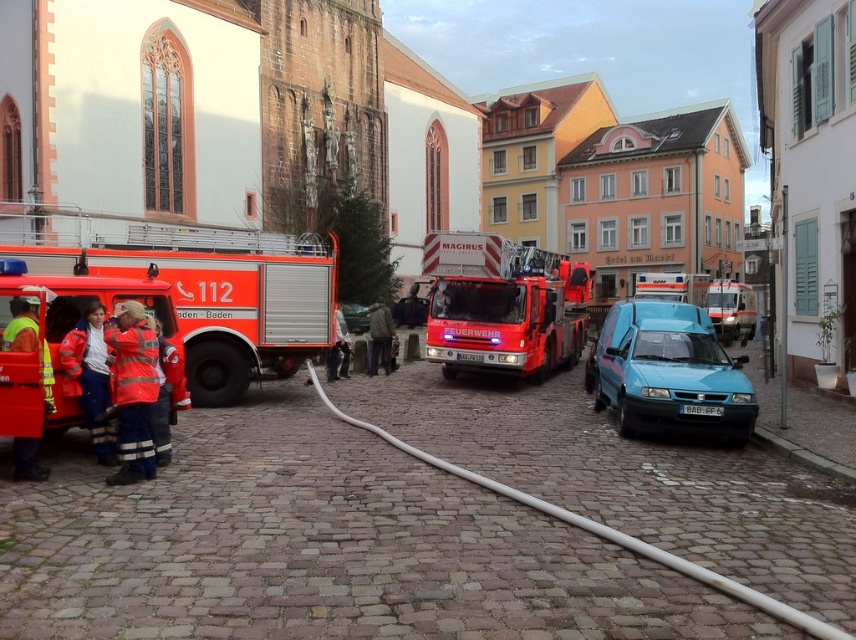
Does orange glossy fire truck at left have a greater width compared to red glossy fire truck at center?

No, orange glossy fire truck at left is not wider than red glossy fire truck at center.

Can you confirm if orange glossy fire truck at left is positioned to the left of red glossy fire truck at center?

Yes, orange glossy fire truck at left is to the left of red glossy fire truck at center.

Describe the element at coordinates (200, 285) in the screenshot. I see `orange glossy fire truck at left` at that location.

This screenshot has height=640, width=856. What are the coordinates of `orange glossy fire truck at left` in the screenshot? It's located at (200, 285).

Is orange glossy fire truck at left above metallic silver car at center?

Indeed, orange glossy fire truck at left is positioned over metallic silver car at center.

Does orange glossy fire truck at left have a larger size compared to metallic silver car at center?

Correct, orange glossy fire truck at left is larger in size than metallic silver car at center.

You are a GUI agent. You are given a task and a screenshot of the screen. Output one action in this format:
    pyautogui.click(x=<x>, y=<y>)
    Task: Click on the orange glossy fire truck at left
    The height and width of the screenshot is (640, 856).
    Given the screenshot: What is the action you would take?
    pyautogui.click(x=200, y=285)

Locate an element on the screen. The image size is (856, 640). orange glossy fire truck at left is located at coordinates (200, 285).

Does matte red fire truck at left have a greater height compared to metallic silver car at center?

Yes, matte red fire truck at left is taller than metallic silver car at center.

The width and height of the screenshot is (856, 640). Describe the element at coordinates (62, 342) in the screenshot. I see `matte red fire truck at left` at that location.

Is point (66, 422) behind point (346, 328)?

That is False.

Image resolution: width=856 pixels, height=640 pixels. I want to click on matte red fire truck at left, so click(62, 342).